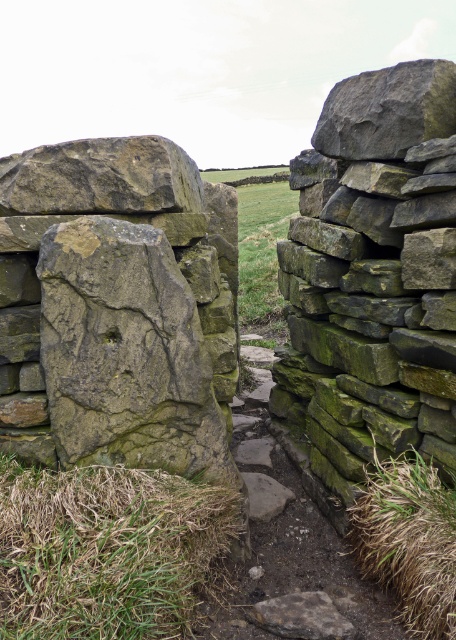
Question: Which object is farther from the camera taking this photo?

Choices:
 (A) rough textured rock at upper right
 (B) rough textured stone at upper left
 (C) rough textured stone at center

Answer: (A)

Question: Does green mossy stone path at center appear under rough textured stone at center?

Choices:
 (A) no
 (B) yes

Answer: (A)

Question: Does green mossy stone wall at right have a greater width compared to rough textured stone at center?

Choices:
 (A) yes
 (B) no

Answer: (A)

Question: Does green mossy stone path at center have a larger size compared to rough textured rock at upper right?

Choices:
 (A) yes
 (B) no

Answer: (A)

Question: Among these points, which one is farthest from the camera?

Choices:
 (A) (68, 547)
 (B) (160, 461)

Answer: (B)

Question: Estimate the real-world distances between objects in this image. Which object is farther from the rough textured stone at center?

Choices:
 (A) green grassy hay at lower left
 (B) green mossy stone at center
 (C) green grassy hay at lower right
 (D) rough textured rock at upper right

Answer: (D)